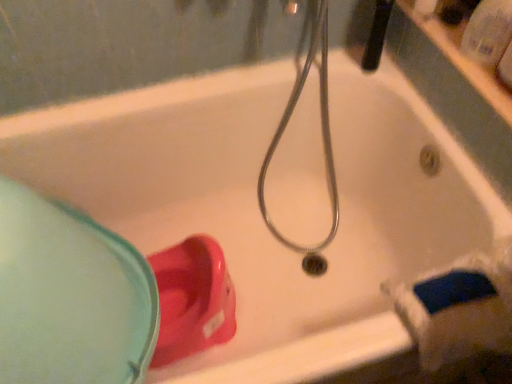
Question: Is black rubber showerhead at upper center facing away from matte plastic cup at lower left?

Choices:
 (A) yes
 (B) no

Answer: (B)

Question: Is black rubber showerhead at upper center at the right side of matte plastic cup at lower left?

Choices:
 (A) no
 (B) yes

Answer: (B)

Question: Considering the relative positions of black rubber showerhead at upper center and matte plastic cup at lower left in the image provided, is black rubber showerhead at upper center to the left of matte plastic cup at lower left from the viewer's perspective?

Choices:
 (A) yes
 (B) no

Answer: (B)

Question: Is black rubber showerhead at upper center bigger than matte plastic cup at lower left?

Choices:
 (A) no
 (B) yes

Answer: (A)

Question: Is black rubber showerhead at upper center facing towards matte plastic cup at lower left?

Choices:
 (A) no
 (B) yes

Answer: (A)

Question: From a real-world perspective, relative to black rubber showerhead at upper center, is matte plastic cup at lower left vertically above or below?

Choices:
 (A) below
 (B) above

Answer: (A)

Question: Is matte plastic cup at lower left inside or outside of black rubber showerhead at upper center?

Choices:
 (A) inside
 (B) outside

Answer: (B)

Question: Visually, is matte plastic cup at lower left positioned to the left or to the right of black rubber showerhead at upper center?

Choices:
 (A) right
 (B) left

Answer: (B)

Question: From their relative heights in the image, would you say matte plastic cup at lower left is taller or shorter than black rubber showerhead at upper center?

Choices:
 (A) short
 (B) tall

Answer: (B)

Question: In terms of height, does black rubber showerhead at upper center look taller or shorter compared to transparent plastic bottle at upper right?

Choices:
 (A) tall
 (B) short

Answer: (A)

Question: From the image's perspective, is black rubber showerhead at upper center above or below transparent plastic bottle at upper right?

Choices:
 (A) above
 (B) below

Answer: (A)

Question: Considering the positions of black rubber showerhead at upper center and transparent plastic bottle at upper right in the image, is black rubber showerhead at upper center bigger or smaller than transparent plastic bottle at upper right?

Choices:
 (A) big
 (B) small

Answer: (A)

Question: Is black rubber showerhead at upper center inside the boundaries of transparent plastic bottle at upper right, or outside?

Choices:
 (A) inside
 (B) outside

Answer: (B)

Question: Looking at the image, does matte plastic cup at lower left seem bigger or smaller compared to transparent plastic bottle at upper right?

Choices:
 (A) small
 (B) big

Answer: (B)

Question: Considering their positions, is matte plastic cup at lower left located in front of or behind transparent plastic bottle at upper right?

Choices:
 (A) front
 (B) behind

Answer: (A)